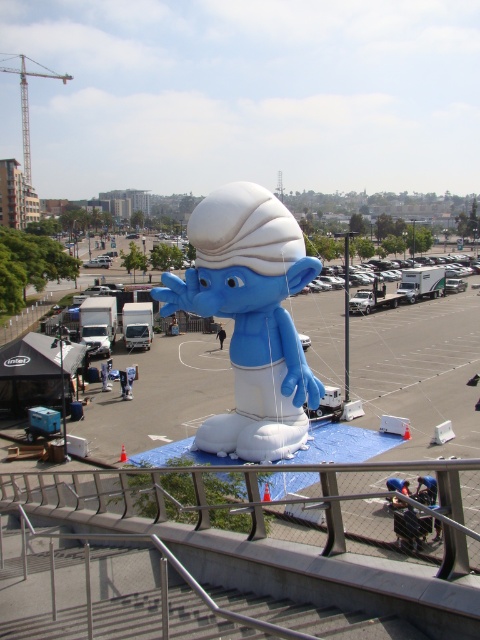
Does blue inflatable smurf at center lie in front of metallic construction crane at upper left?

Yes, blue inflatable smurf at center is in front of metallic construction crane at upper left.

Who is shorter, blue inflatable smurf at center or metallic construction crane at upper left?

blue inflatable smurf at center

Locate an element on the screen. This screenshot has height=640, width=480. blue inflatable smurf at center is located at coordinates (273, 541).

Find the location of `blue inflatable smurf at center`. blue inflatable smurf at center is located at coordinates (273, 541).

Does point (190, 528) come in front of point (277, 385)?

That is True.

Does blue inflatable smurf at center appear over white matte inflatable at center?

Actually, blue inflatable smurf at center is below white matte inflatable at center.

Which is in front, point (435, 618) or point (313, 397)?

Positioned in front is point (435, 618).

Where is `blue inflatable smurf at center`? The width and height of the screenshot is (480, 640). blue inflatable smurf at center is located at coordinates [x=273, y=541].

Does satin silver railing at center appear on the right side of blue inflatable smurf at center?

Correct, you'll find satin silver railing at center to the right of blue inflatable smurf at center.

Can you confirm if satin silver railing at center is bigger than blue inflatable smurf at center?

Incorrect, satin silver railing at center is not larger than blue inflatable smurf at center.

Who is more distant from viewer, (430, 621) or (474, 612)?

Positioned behind is point (430, 621).

Locate an element on the screen. The image size is (480, 640). satin silver railing at center is located at coordinates (275, 544).